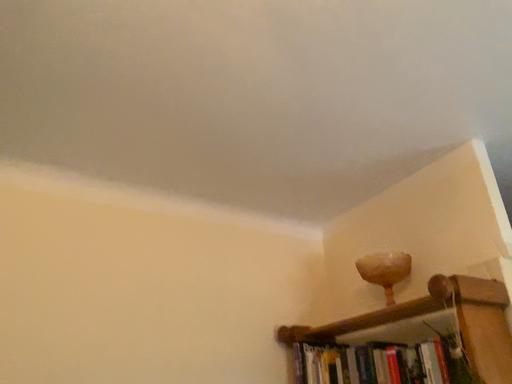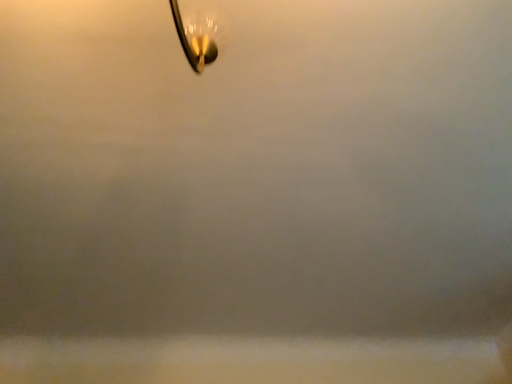
Question: How did the camera likely rotate when shooting the video?

Choices:
 (A) rotated downward
 (B) rotated upward

Answer: (B)